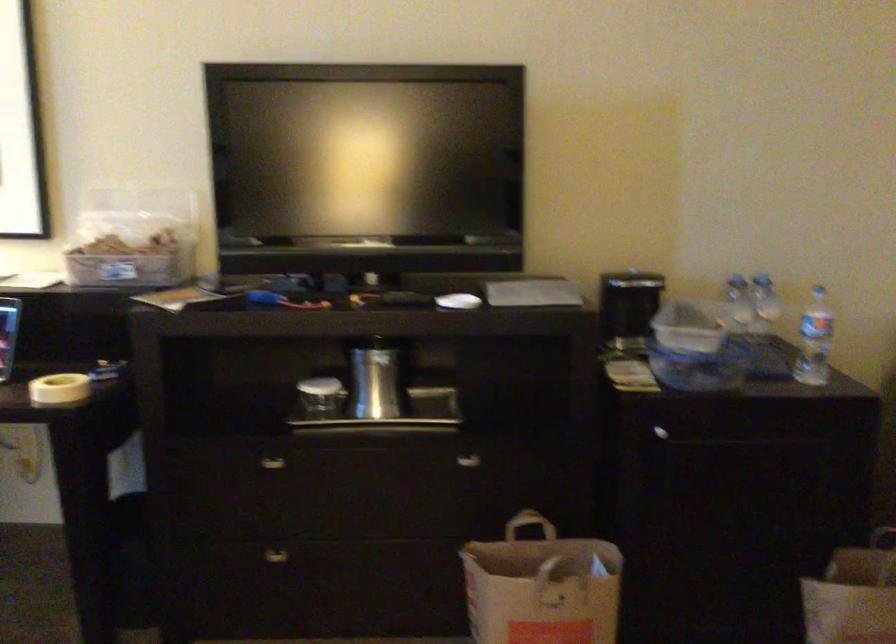
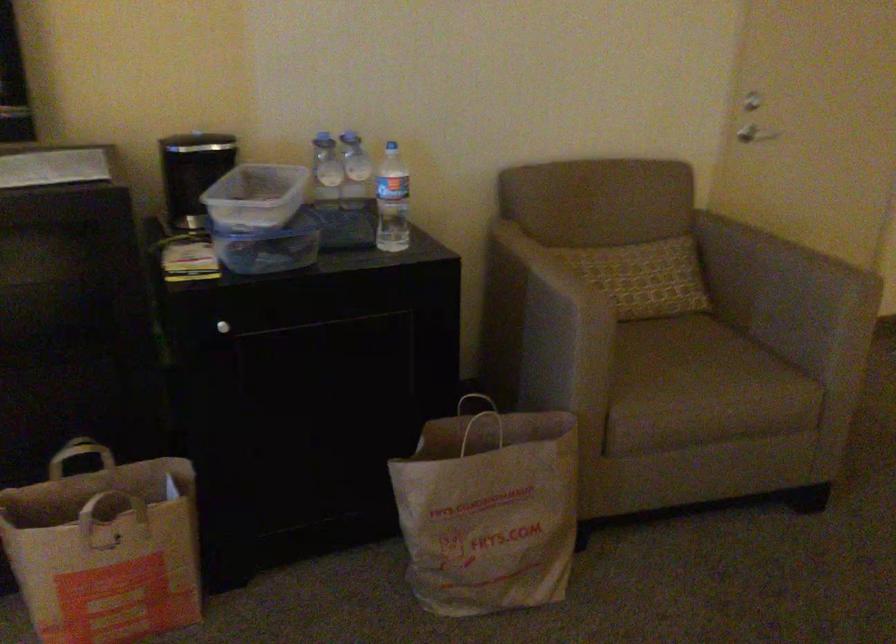
Question: The camera is either moving clockwise (left) or counter-clockwise (right) around the object. The first image is from the beginning of the video and the second image is from the end. Is the camera moving left or right when shooting the video?

Choices:
 (A) Left
 (B) Right

Answer: (A)